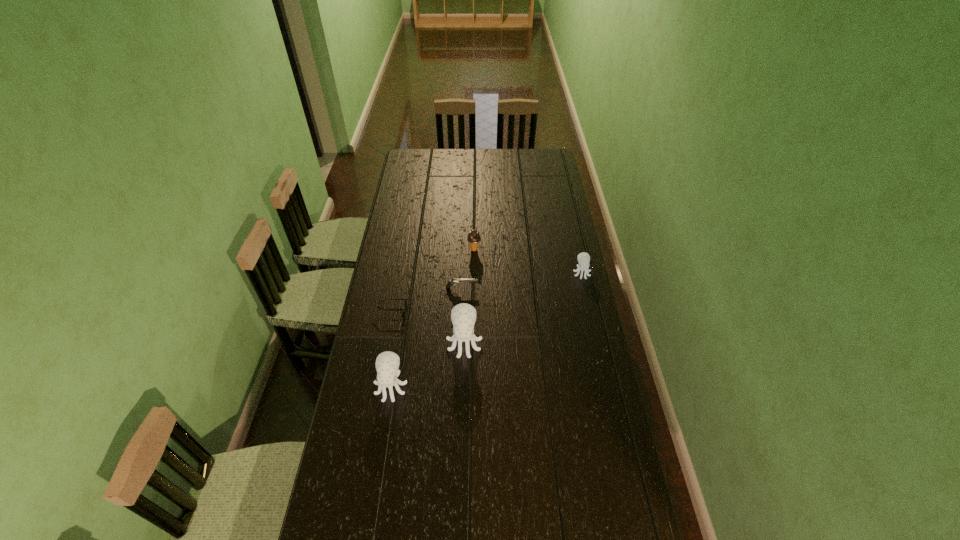
Image resolution: width=960 pixels, height=540 pixels. I want to click on free spot between the shortest octopus and the pistol, so click(521, 280).

The width and height of the screenshot is (960, 540). Find the location of `free spot between the sunglasses and the third tallest object`. free spot between the sunglasses and the third tallest object is located at coordinates (432, 281).

Where is `free space between the farthest octopus and the nearest octopus`? This screenshot has height=540, width=960. free space between the farthest octopus and the nearest octopus is located at coordinates (487, 329).

Locate an element on the screen. The height and width of the screenshot is (540, 960). vacant space that's between the sunglasses and the rightmost octopus is located at coordinates (486, 293).

What are the coordinates of `the second closest object to the second tallest octopus` in the screenshot? It's located at (403, 314).

Locate an element on the screen. object that is the third closest one to the fifth tallest object is located at coordinates (474, 238).

Identify which octopus is the second nearest to the rightmost object. Please provide its 2D coordinates. Your answer should be formatted as a tuple, i.e. [(x, y)], where the tuple contains the x and y coordinates of a point satisfying the conditions above.

[(387, 363)]

Identify the location of the closest octopus relative to the shortest object. (463, 316).

The image size is (960, 540). Find the location of `free space that satisfies the following two spatial constraints: 1. on the front-facing side of the shortest octopus; 2. on the front-facing side of the fourth farthest object`. free space that satisfies the following two spatial constraints: 1. on the front-facing side of the shortest octopus; 2. on the front-facing side of the fourth farthest object is located at coordinates coord(590,313).

This screenshot has width=960, height=540. Find the location of `free spot that satisfies the following two spatial constraints: 1. on the front-facing side of the second shortest object; 2. on the front-facing side of the leftmost octopus`. free spot that satisfies the following two spatial constraints: 1. on the front-facing side of the second shortest object; 2. on the front-facing side of the leftmost octopus is located at coordinates (458, 386).